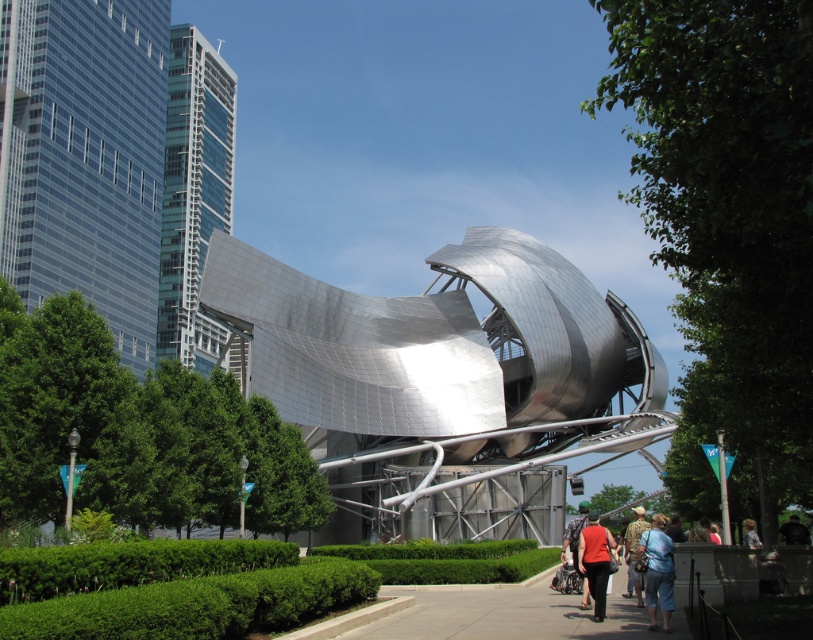
You are standing in front of the curved metallic sculpture and want to determine which of the two points, point (662, 637) or point (625, 531), is nearer to you. Based on the scene, which point is closer?

Point (662, 637) is closer to the viewer than point (625, 531).

You are standing at the point with coordinates (509, 612) in the image. What object is located at that exact point?

The concrete sidewalk at center is located at point (509, 612).

You are standing at the entrance of the architectural structure and see the concrete sidewalk at center and the camouflage fabric shirt at center. Which object is positioned to the left when viewed from your perspective?

The concrete sidewalk at center is positioned to the left of the camouflage fabric shirt at center from your perspective.